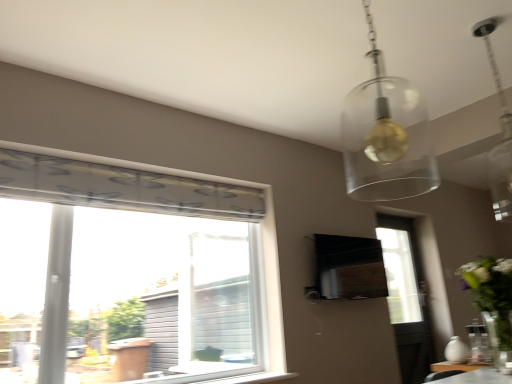
Question: Are translucent glass globe at upper center and white glossy vase at right making contact?

Choices:
 (A) yes
 (B) no

Answer: (B)

Question: Can you confirm if translucent glass globe at upper center is positioned to the left of white glossy vase at right?

Choices:
 (A) yes
 (B) no

Answer: (A)

Question: Is translucent glass globe at upper center smaller than white glossy vase at right?

Choices:
 (A) yes
 (B) no

Answer: (A)

Question: From a real-world perspective, is translucent glass globe at upper center beneath white glossy vase at right?

Choices:
 (A) yes
 (B) no

Answer: (B)

Question: Considering the relative sizes of translucent glass globe at upper center and white glossy vase at right in the image provided, is translucent glass globe at upper center shorter than white glossy vase at right?

Choices:
 (A) yes
 (B) no

Answer: (B)

Question: Would you say translucent glass globe at upper center is to the left or to the right of clear glass pendant light at upper right in the picture?

Choices:
 (A) right
 (B) left

Answer: (B)

Question: Is point (350, 193) closer or farther from the camera than point (499, 97)?

Choices:
 (A) closer
 (B) farther

Answer: (B)

Question: Looking at their shapes, would you say translucent glass globe at upper center is wider or thinner than clear glass pendant light at upper right?

Choices:
 (A) wide
 (B) thin

Answer: (A)

Question: In terms of height, does translucent glass globe at upper center look taller or shorter compared to clear glass pendant light at upper right?

Choices:
 (A) short
 (B) tall

Answer: (A)

Question: From the image's perspective, is white matte vase at lower right located above or below translucent glass globe at upper center?

Choices:
 (A) below
 (B) above

Answer: (A)

Question: From a real-world perspective, is white matte vase at lower right physically located above or below translucent glass globe at upper center?

Choices:
 (A) above
 (B) below

Answer: (B)

Question: Considering the positions of white matte vase at lower right and translucent glass globe at upper center in the image, is white matte vase at lower right taller or shorter than translucent glass globe at upper center?

Choices:
 (A) tall
 (B) short

Answer: (B)

Question: Is white matte vase at lower right inside the boundaries of translucent glass globe at upper center, or outside?

Choices:
 (A) inside
 (B) outside

Answer: (B)

Question: Considering the positions of point (266, 379) and point (387, 104), is point (266, 379) closer or farther from the camera than point (387, 104)?

Choices:
 (A) closer
 (B) farther

Answer: (A)

Question: Is white plastic window sill at lower center bigger or smaller than translucent glass globe at upper center?

Choices:
 (A) small
 (B) big

Answer: (A)